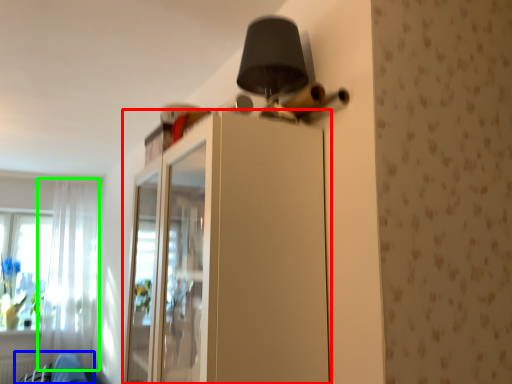
Question: Considering the real-world distances, which object is farthest from dresser (highlighted by a red box)? swivel chair (highlighted by a blue box) or curtain (highlighted by a green box)?

Choices:
 (A) swivel chair
 (B) curtain

Answer: (B)